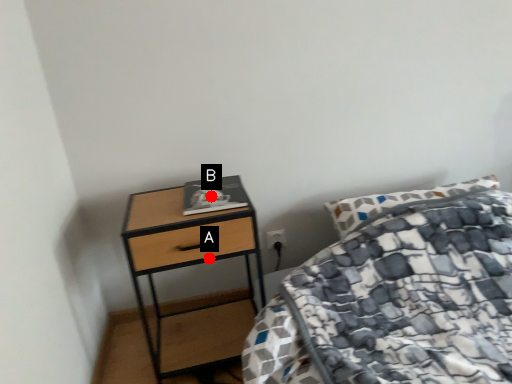
Question: Two points are circled on the image, labeled by A and B beside each circle. Which of the following is the closest to the observer?

Choices:
 (A) A is closer
 (B) B is closer

Answer: (A)